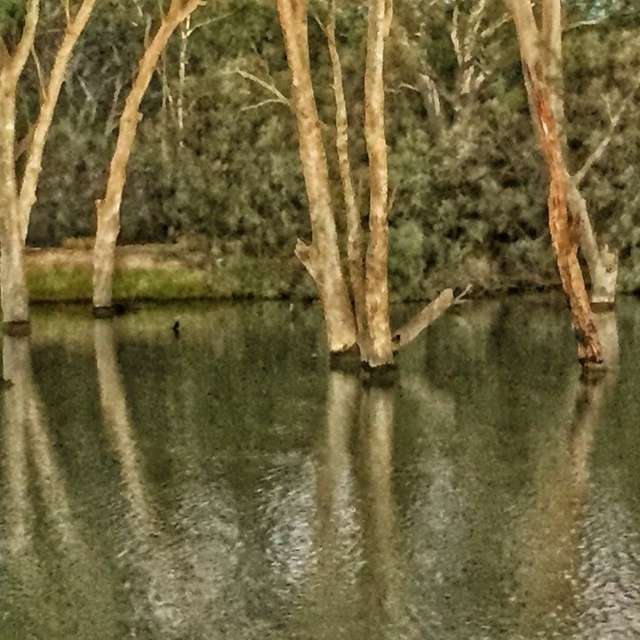
You are an environmental researcher observing the scene. You need to determine which object is shorter between the greenish reflective water at center and the brown rough bark tree at center. Which one is shorter?

The greenish reflective water at center is shorter than the brown rough bark tree at center.

What is the exact coordinate of the greenish reflective water at center in the image?

The greenish reflective water at center is located at point (316, 481).

You are standing at the edge of the water and want to place a small floating decoration on the greenish reflective water at center. However, there is a brown rough bark tree at center above it. Can you place the decoration directly under the tree without it being blocked?

The greenish reflective water at center is positioned under the brown rough bark tree at center, so placing the decoration directly under the tree would mean it is beneath the tree and not blocked by it. However, the tree itself may cast a shadow over the water, potentially affecting visibility of the decoration.